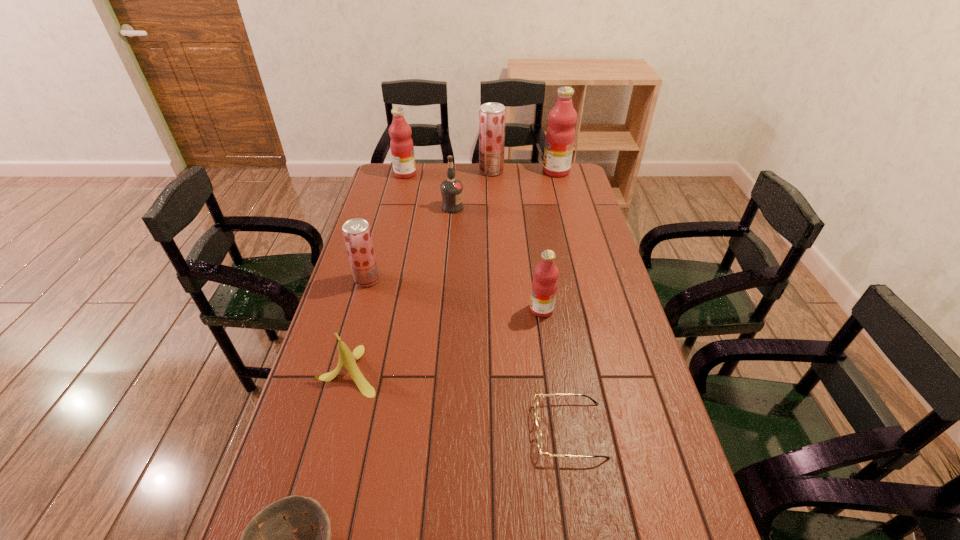
Where is `vacant area that lies between the fifth object from right to left and the fourth nearest object`? The height and width of the screenshot is (540, 960). vacant area that lies between the fifth object from right to left and the fourth nearest object is located at coordinates (497, 259).

This screenshot has height=540, width=960. What are the coordinates of `empty space that is in between the second pink fruit juice from right to left and the biggest pink fruit juice` in the screenshot? It's located at (549, 240).

Locate an element on the screen. This screenshot has height=540, width=960. unoccupied area between the eighth farthest object and the second nearest fruit juice is located at coordinates (468, 355).

Identify which object is the third closest to the sixth object from left to right. Please provide its 2D coordinates. Your answer should be formatted as a tuple, i.e. [(x, y)], where the tuple contains the x and y coordinates of a point satisfying the conditions above.

[(402, 149)]

Where is `the fourth closest object to the fifth object from left to right`? the fourth closest object to the fifth object from left to right is located at coordinates (560, 135).

Find the location of a particular element. This screenshot has height=540, width=960. fruit juice that can be found as the second closest to the eighth tallest object is located at coordinates (544, 285).

You are a GUI agent. You are given a task and a screenshot of the screen. Output one action in this format:
    pyautogui.click(x=<x>, y=<y>)
    Task: Click on the fifth closest fruit juice to the third nearest object
    The height and width of the screenshot is (540, 960).
    Given the screenshot: What is the action you would take?
    pyautogui.click(x=560, y=135)

Where is `pink fruit juice that is the closest to the nearest fruit juice`? pink fruit juice that is the closest to the nearest fruit juice is located at coordinates (560, 135).

Find the location of `the second closest pink fruit juice to the second smallest pink fruit juice`. the second closest pink fruit juice to the second smallest pink fruit juice is located at coordinates (544, 285).

Locate an element on the screen. This screenshot has height=540, width=960. free spot that satisfies the following two spatial constraints: 1. on the back side of the third fruit juice from right to left; 2. on the right side of the third nearest object is located at coordinates (402, 171).